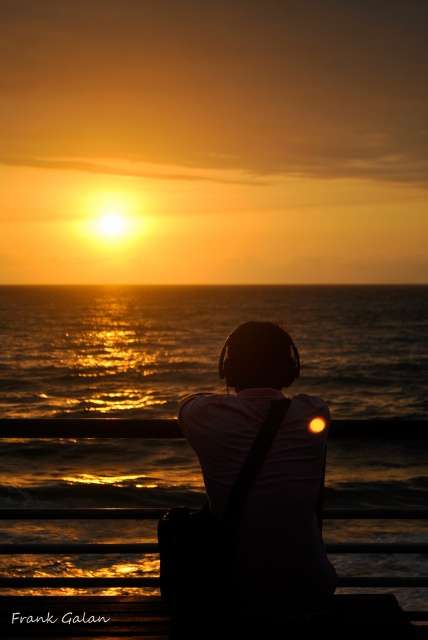
Is shiny golden water at center below black matte headphones at center?

No, shiny golden water at center is not below black matte headphones at center.

Describe the element at coordinates (207, 346) in the screenshot. I see `shiny golden water at center` at that location.

At what (x,y) coordinates should I click in order to perform the action: click on shiny golden water at center. Please return your answer as a coordinate pair (x, y). This screenshot has width=428, height=640. Looking at the image, I should click on (207, 346).